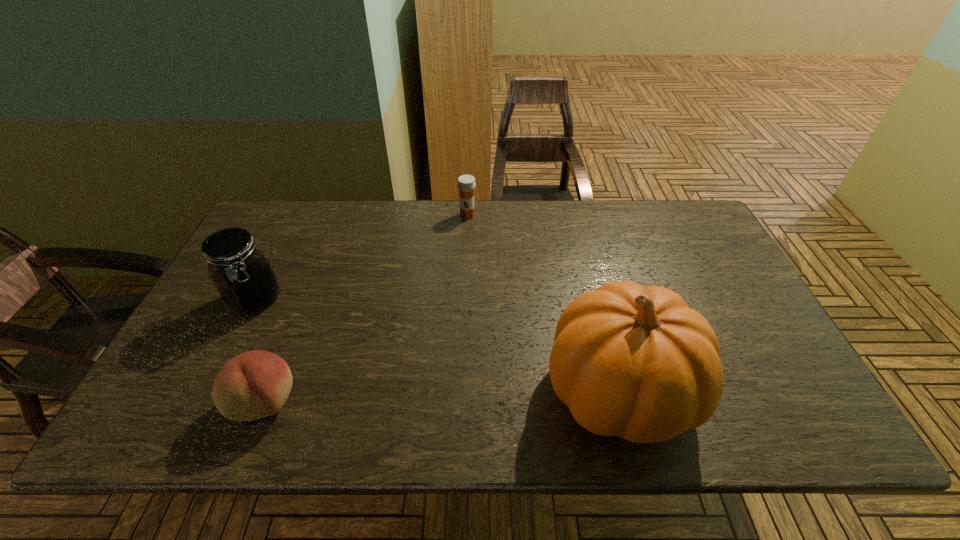
Locate an element on the screen. The width and height of the screenshot is (960, 540). vacant space in between the tallest object and the third nearest object is located at coordinates (437, 346).

Find the location of a particular element. free spot between the tallest object and the third nearest object is located at coordinates (437, 346).

Select which object appears as the second closest to the medicine. Please provide its 2D coordinates. Your answer should be formatted as a tuple, i.e. [(x, y)], where the tuple contains the x and y coordinates of a point satisfying the conditions above.

[(244, 278)]

Where is `object that ranks as the second closest to the medicine`? object that ranks as the second closest to the medicine is located at coordinates (244, 278).

I want to click on vacant area in the image that satisfies the following two spatial constraints: 1. on the front side of the tallest object; 2. on the left side of the third object from left to right, so click(461, 390).

I want to click on free location that satisfies the following two spatial constraints: 1. on the front side of the rightmost object; 2. on the left side of the jar, so click(210, 390).

Identify the location of free location that satisfies the following two spatial constraints: 1. on the back side of the farthest object; 2. on the left side of the peach. Image resolution: width=960 pixels, height=540 pixels. (338, 215).

This screenshot has height=540, width=960. I want to click on free space that satisfies the following two spatial constraints: 1. on the front side of the rightmost object; 2. on the left side of the medicine, so click(x=461, y=390).

In order to click on vacant region that satisfies the following two spatial constraints: 1. on the back side of the peach; 2. on the right side of the rightmost object in this screenshot , I will do `click(270, 390)`.